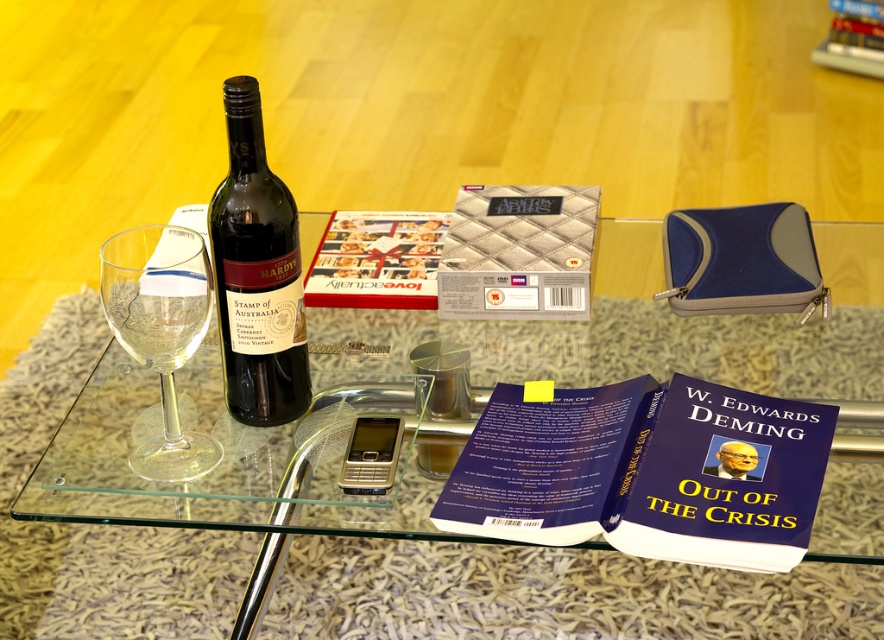
Question: Which point appears farthest from the camera in this image?

Choices:
 (A) (250, 310)
 (B) (324, 228)
 (C) (158, 227)
 (D) (713, 433)

Answer: (B)

Question: Does blue hardcover book at center have a lesser width compared to matte glass wine bottle at center?

Choices:
 (A) no
 (B) yes

Answer: (A)

Question: Can you confirm if transparent glass table at center is positioned to the left of matte glass wine bottle at center?

Choices:
 (A) yes
 (B) no

Answer: (B)

Question: Among these objects, which one is farthest from the camera?

Choices:
 (A) transparent glass table at center
 (B) matte glass wine bottle at center

Answer: (A)

Question: Which point is closer to the camera?

Choices:
 (A) (610, 416)
 (B) (273, 349)
 (C) (341, 292)

Answer: (B)

Question: Can you confirm if transparent glass table at center is smaller than matte glass wine bottle at center?

Choices:
 (A) yes
 (B) no

Answer: (B)